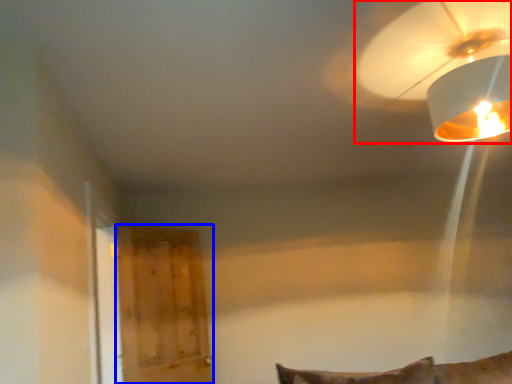
Question: Which object is closer to the camera taking this photo, lamp (highlighted by a red box) or glass door (highlighted by a blue box)?

Choices:
 (A) lamp
 (B) glass door

Answer: (A)